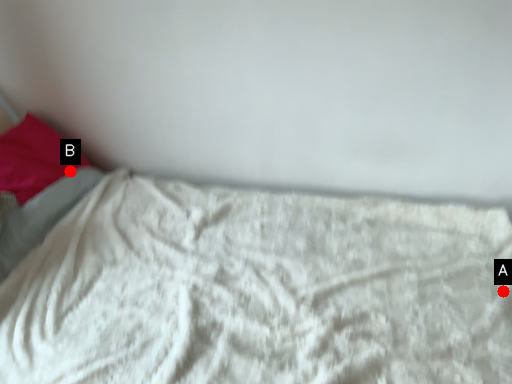
Question: Two points are circled on the image, labeled by A and B beside each circle. Which of the following is the closest to the observer?

Choices:
 (A) A is closer
 (B) B is closer

Answer: (A)